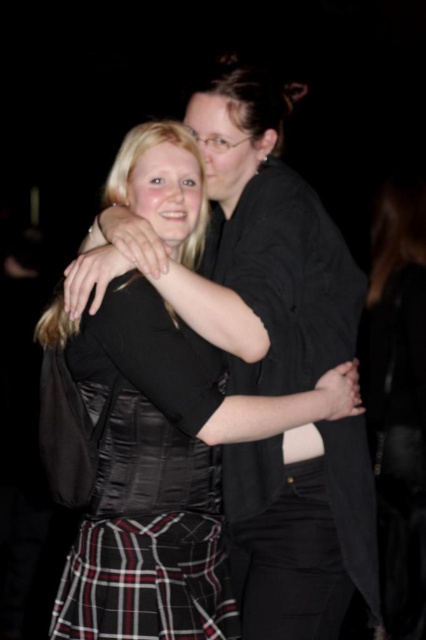
Question: Is plaid fabric dress at center below plaid fabric kilt at lower center?

Choices:
 (A) no
 (B) yes

Answer: (A)

Question: Does plaid fabric dress at center appear on the left side of plaid fabric kilt at lower center?

Choices:
 (A) no
 (B) yes

Answer: (B)

Question: Among these objects, which one is farthest from the camera?

Choices:
 (A) plaid fabric kilt at lower center
 (B) satin black dress at center
 (C) plaid fabric dress at center

Answer: (B)

Question: Does satin black dress at center come in front of plaid fabric dress at center?

Choices:
 (A) yes
 (B) no

Answer: (B)

Question: Which of the following is the closest to the observer?

Choices:
 (A) plaid fabric dress at center
 (B) satin black dress at center
 (C) plaid fabric kilt at lower center

Answer: (C)

Question: Which of the following is the closest to the observer?

Choices:
 (A) satin black dress at center
 (B) plaid fabric dress at center
 (C) plaid fabric kilt at lower center

Answer: (C)